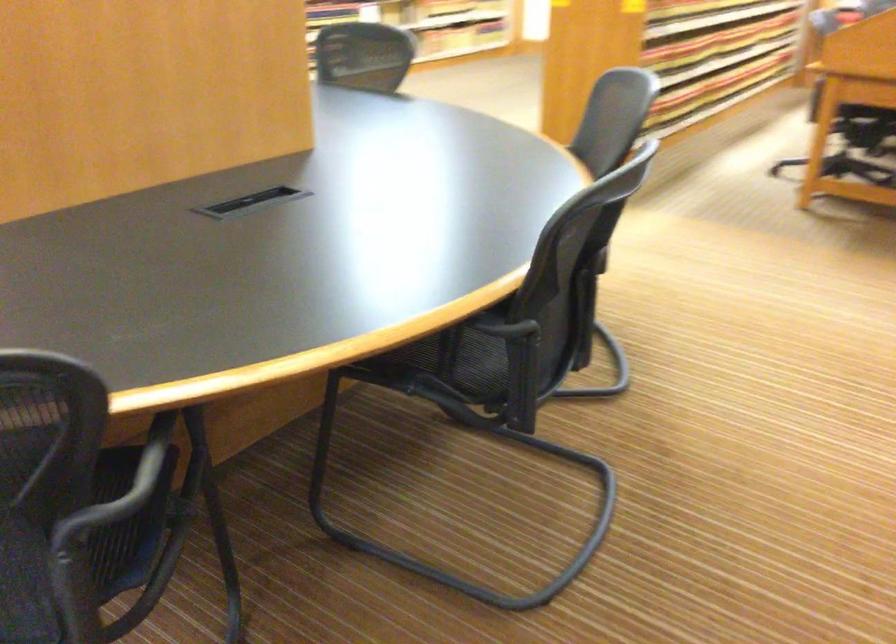
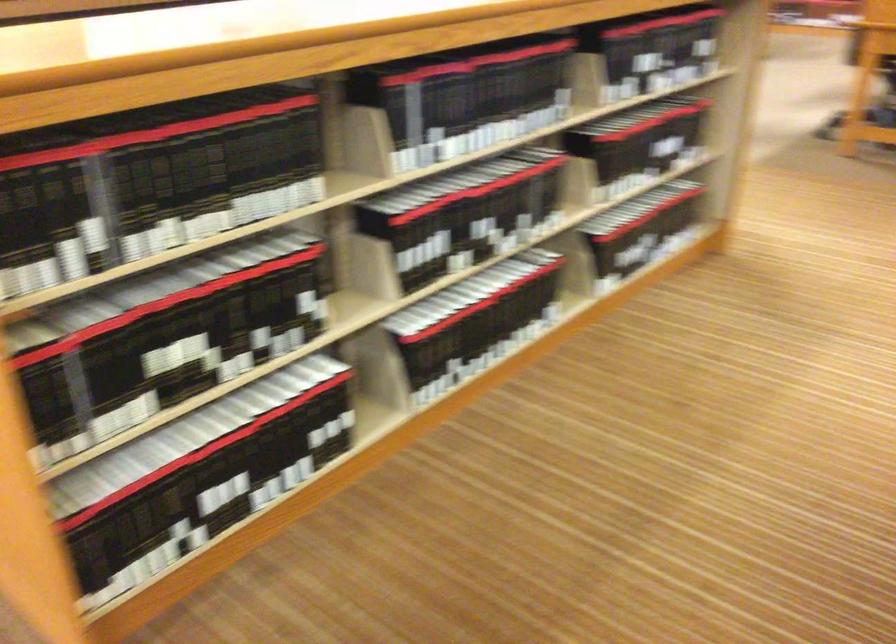
Question: The images are taken continuously from a first-person perspective. In which direction are you moving?

Choices:
 (A) Left
 (B) Right
 (C) Forward
 (D) Backward

Answer: (A)